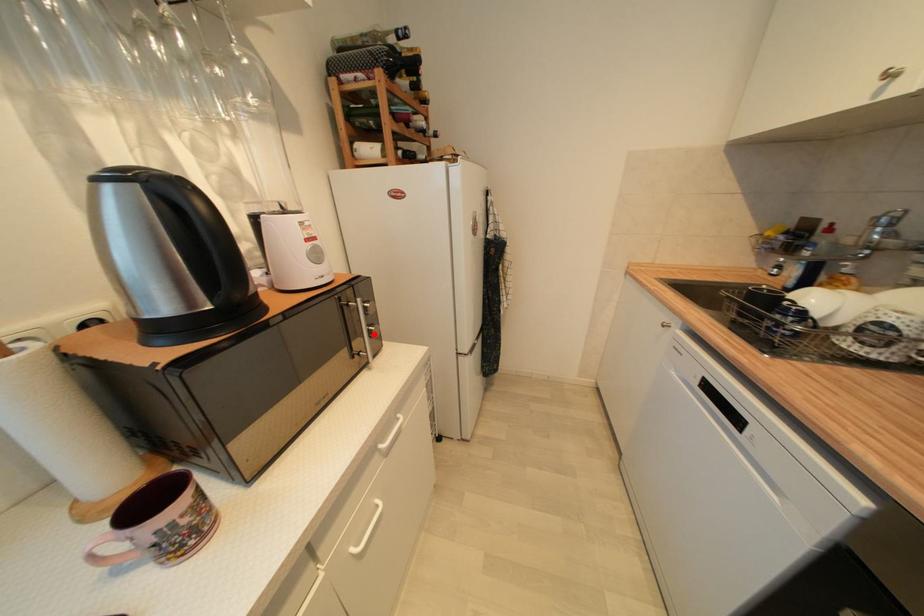
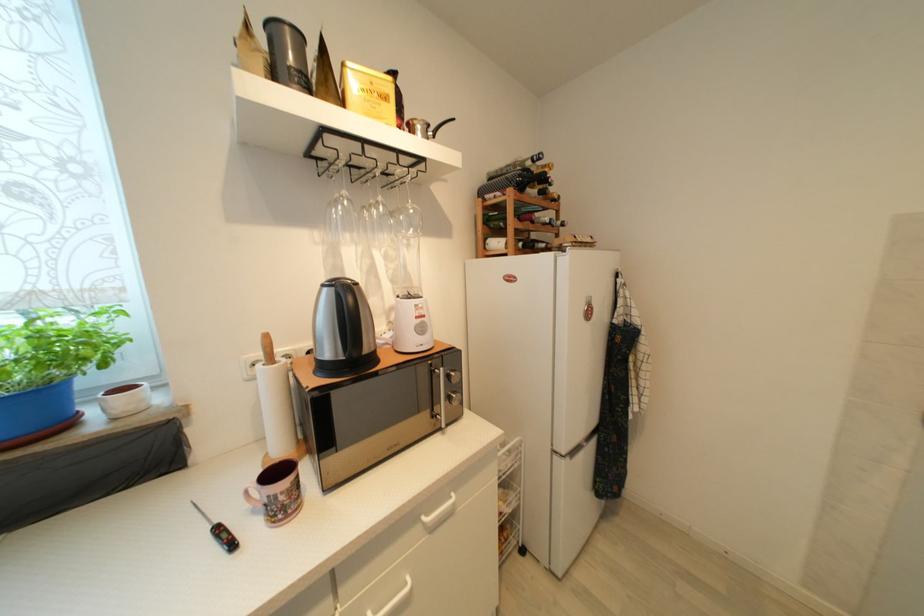
Question: I am providing you with two images of the same scene from different viewpoints. In image1, a red point is highlighted. Considering the same 3D point in image2, which of the following is correct?

Choices:
 (A) It is closer
 (B) It is farther

Answer: (B)